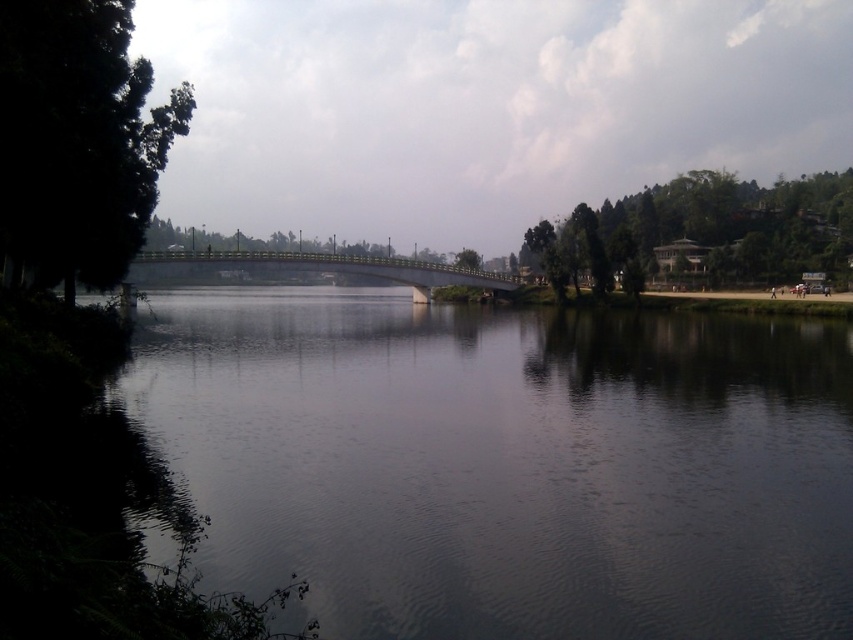
Is green leafy trees at right closer to the viewer compared to green leafy tree at center?

Yes, green leafy trees at right is in front of green leafy tree at center.

Which is below, green leafy trees at right or green leafy tree at center?

green leafy tree at center is below.

Measure the distance between green leafy trees at right and camera.

A distance of 101.47 meters exists between green leafy trees at right and camera.

Identify the location of green leafy trees at right. [704, 230].

Can you confirm if smooth dark water at center is bigger than green leafy tree at center?

Correct, smooth dark water at center is larger in size than green leafy tree at center.

Does smooth dark water at center appear over green leafy tree at center?

No.

This screenshot has height=640, width=853. In order to click on smooth dark water at center in this screenshot , I will do `click(508, 461)`.

You are a GUI agent. You are given a task and a screenshot of the screen. Output one action in this format:
    pyautogui.click(x=<x>, y=<y>)
    Task: Click on the smooth dark water at center
    The image size is (853, 640).
    Given the screenshot: What is the action you would take?
    pyautogui.click(x=508, y=461)

Is green leafy trees at right above green metallic bridge at center?

Indeed, green leafy trees at right is positioned over green metallic bridge at center.

From the picture: Which is above, green leafy trees at right or green metallic bridge at center?

Positioned higher is green leafy trees at right.

The image size is (853, 640). What are the coordinates of `green leafy trees at right` in the screenshot? It's located at (704, 230).